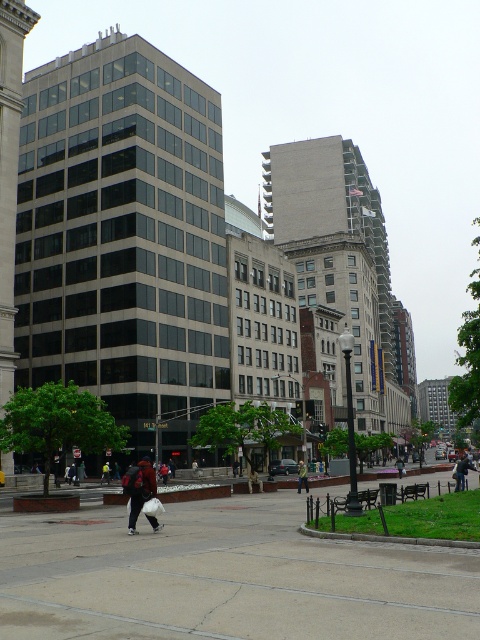
Does green fabric jacket at center have a greater width compared to dark gray jacket at center?

No, green fabric jacket at center is not wider than dark gray jacket at center.

Can you confirm if green fabric jacket at center is thinner than dark gray jacket at center?

Indeed, green fabric jacket at center has a lesser width compared to dark gray jacket at center.

Who is more forward, [301,460] or [400,458]?

Point [301,460] is in front.

Locate an element on the screen. The width and height of the screenshot is (480, 640). green fabric jacket at center is located at coordinates (301, 476).

From the picture: Can you confirm if dark brown leather backpack at center is positioned to the left of green fabric jacket at center?

Yes, dark brown leather backpack at center is to the left of green fabric jacket at center.

Is dark brown leather backpack at center thinner than green fabric jacket at center?

No.

Image resolution: width=480 pixels, height=640 pixels. I want to click on dark brown leather backpack at center, so click(139, 488).

Can you confirm if dark brown leather backpack at center is thinner than dark gray jacket at center?

Yes.

Is point (134, 477) closer to camera compared to point (397, 458)?

Yes.

Is point (131, 483) positioned behind point (402, 470)?

No, (131, 483) is closer to viewer.

Locate an element on the screen. dark brown leather backpack at center is located at coordinates (139, 488).